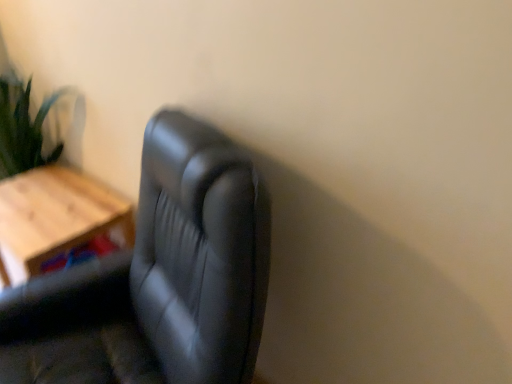
Where is `wooden table at left`? wooden table at left is located at coordinates [56, 218].

This screenshot has height=384, width=512. What do you see at coordinates (56, 218) in the screenshot? I see `wooden table at left` at bounding box center [56, 218].

What do you see at coordinates (157, 279) in the screenshot?
I see `black leather chair at center` at bounding box center [157, 279].

You are a GUI agent. You are given a task and a screenshot of the screen. Output one action in this format:
    pyautogui.click(x=<x>, y=<y>)
    Task: Click on the black leather chair at center
    This screenshot has width=512, height=384.
    Given the screenshot: What is the action you would take?
    pyautogui.click(x=157, y=279)

This screenshot has width=512, height=384. Identify the location of wooden table at left. (56, 218).

Visually, is wooden table at left positioned to the left or to the right of black leather chair at center?

From the image, it's evident that wooden table at left is to the left of black leather chair at center.

In the scene shown: Is wooden table at left closer to the viewer compared to black leather chair at center?

No, it is not.

Which is less distant, [18,228] or [243,376]?

Point [243,376]

From the image's perspective, is wooden table at left on black leather chair at center?

Indeed, from the image's perspective, wooden table at left is shown above black leather chair at center.

From a real-world perspective, is wooden table at left physically located above or below black leather chair at center?

In terms of real-world spatial position, wooden table at left is below black leather chair at center.

Looking at their sizes, would you say wooden table at left is wider or thinner than black leather chair at center?

Clearly, wooden table at left has less width compared to black leather chair at center.

Which of these two, wooden table at left or black leather chair at center, stands taller?

black leather chair at center.

Between wooden table at left and black leather chair at center, which one has larger size?

black leather chair at center is bigger.

Can we say wooden table at left lies outside black leather chair at center?

Yes, wooden table at left is outside of black leather chair at center.

Does wooden table at left touch black leather chair at center?

wooden table at left is not next to black leather chair at center, and they're not touching.

Is wooden table at left turned away from black leather chair at center?

That's not correct — wooden table at left is not looking away from black leather chair at center.

How distant is wooden table at left from black leather chair at center?

wooden table at left is 40.84 centimeters from black leather chair at center.

Find the location of a particular element. This screenshot has width=512, height=384. table to the left of black leather chair at center is located at coordinates (56, 218).

Can you confirm if black leather chair at center is positioned to the right of wooden table at left?

Yes.

Relative to wooden table at left, is black leather chair at center in front or behind?

Visually, black leather chair at center is located in front of wooden table at left.

Is point (229, 274) positioned after point (76, 189)?

No, it is not.

From the image's perspective, is black leather chair at center located beneath wooden table at left?

Correct, black leather chair at center appears lower than wooden table at left in the image.

From a real-world perspective, which is physically below, black leather chair at center or wooden table at left?

wooden table at left is physically lower.

Can you confirm if black leather chair at center is wider than wooden table at left?

Correct, the width of black leather chair at center exceeds that of wooden table at left.

Is black leather chair at center taller or shorter than wooden table at left?

Considering their sizes, black leather chair at center has more height than wooden table at left.

In terms of size, does black leather chair at center appear bigger or smaller than wooden table at left?

Clearly, black leather chair at center is larger in size than wooden table at left.

Would you say wooden table at left is part of black leather chair at center's contents?

No, wooden table at left is not surrounded by black leather chair at center.

Are black leather chair at center and wooden table at left far apart?

No, black leather chair at center is not far from wooden table at left.

Is black leather chair at center oriented away from wooden table at left?

That's not correct — black leather chair at center is not looking away from wooden table at left.

How many degrees apart are the facing directions of black leather chair at center and wooden table at left?

The angular difference between black leather chair at center and wooden table at left is 15.5 degrees.

Identify the location of chair in front of the wooden table at left. This screenshot has height=384, width=512. (157, 279).

The width and height of the screenshot is (512, 384). I want to click on table that appears above the black leather chair at center (from the image's perspective), so click(56, 218).

Identify the location of table behind the black leather chair at center. (56, 218).